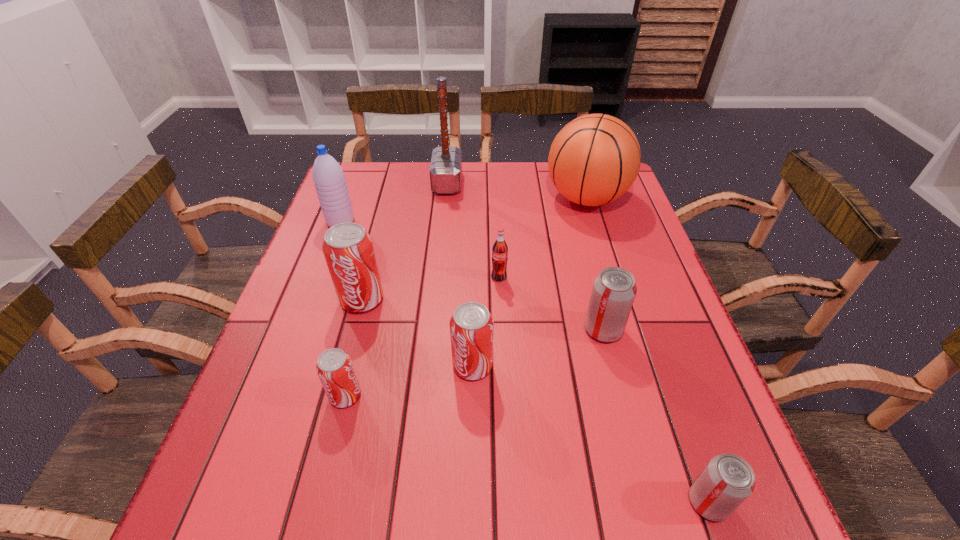
I want to click on brown hammer, so click(445, 170).

Find the location of a particular element. The width and height of the screenshot is (960, 540). the fourth object from left to right is located at coordinates (445, 170).

Find the location of a particular element. The image size is (960, 540). basketball is located at coordinates (594, 159).

This screenshot has width=960, height=540. I want to click on water bottle, so click(x=329, y=179).

You are a GUI agent. You are given a task and a screenshot of the screen. Output one action in this format:
    pyautogui.click(x=<x>, y=<y>)
    Task: Click on the blue water bottle
    
    Given the screenshot: What is the action you would take?
    pyautogui.click(x=329, y=179)

Where is `the farthest red soda can`? The image size is (960, 540). the farthest red soda can is located at coordinates (348, 249).

Locate an element on the screen. the tallest soda can is located at coordinates (348, 249).

I want to click on the farther gray soda can, so click(614, 289).

Identify the location of the bigger gray soda can. (614, 289).

Find the location of `the rightmost red soda can`. the rightmost red soda can is located at coordinates (471, 326).